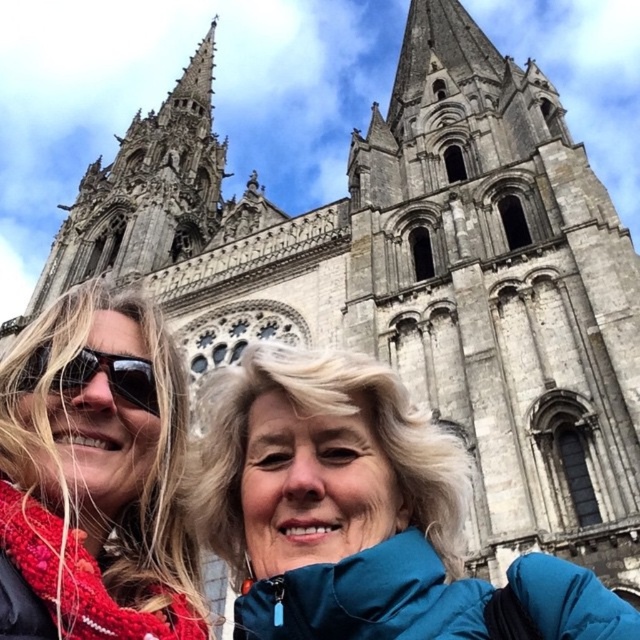
Is point (124, 356) farther from viewer compared to point (64, 371)?

That is True.

Is matte red scarf at lower left below black plastic goggles at left?

Yes.

This screenshot has height=640, width=640. I want to click on matte red scarf at lower left, so click(x=93, y=476).

Locate an element on the screen. The width and height of the screenshot is (640, 640). matte red scarf at lower left is located at coordinates (93, 476).

How far apart are blue fabric jacket at center and black plastic goggles at left?

blue fabric jacket at center and black plastic goggles at left are 12.85 meters apart.

Does blue fabric jacket at center lie in front of black plastic goggles at left?

Yes, it is in front of black plastic goggles at left.

Is point (432, 560) closer to viewer compared to point (32, 390)?

Yes, it is in front of point (32, 390).

Find the location of `blue fabric jacket at center`. blue fabric jacket at center is located at coordinates (333, 499).

Does point (424, 540) come in front of point (90, 588)?

No, (424, 540) is further to viewer.

Who is taller, blue fabric jacket at center or matte red scarf at lower left?

With more height is matte red scarf at lower left.

Is point (449, 515) closer to camera compared to point (65, 332)?

That is False.

At what (x,y) coordinates should I click in order to perform the action: click on blue fabric jacket at center. Please return your answer as a coordinate pair (x, y). Looking at the image, I should click on (333, 499).